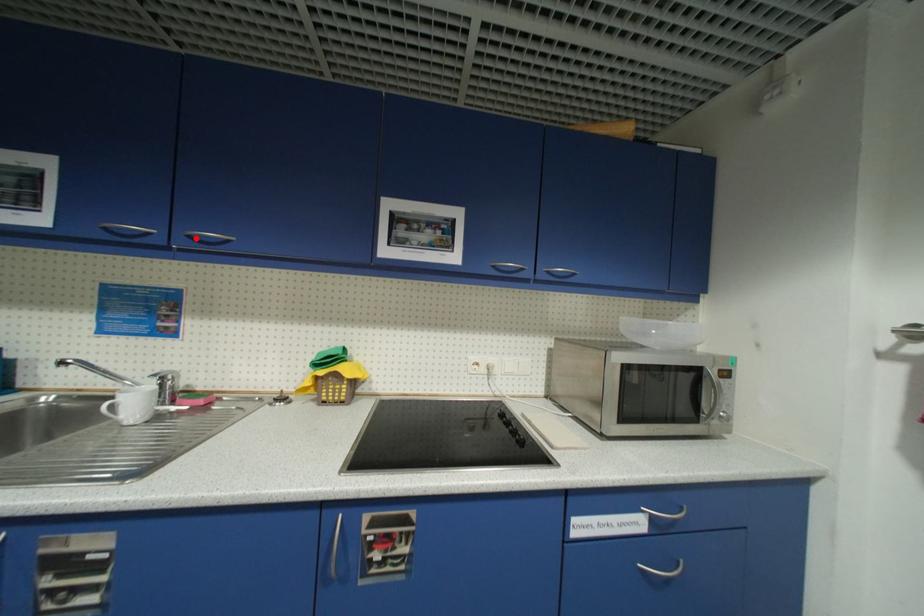
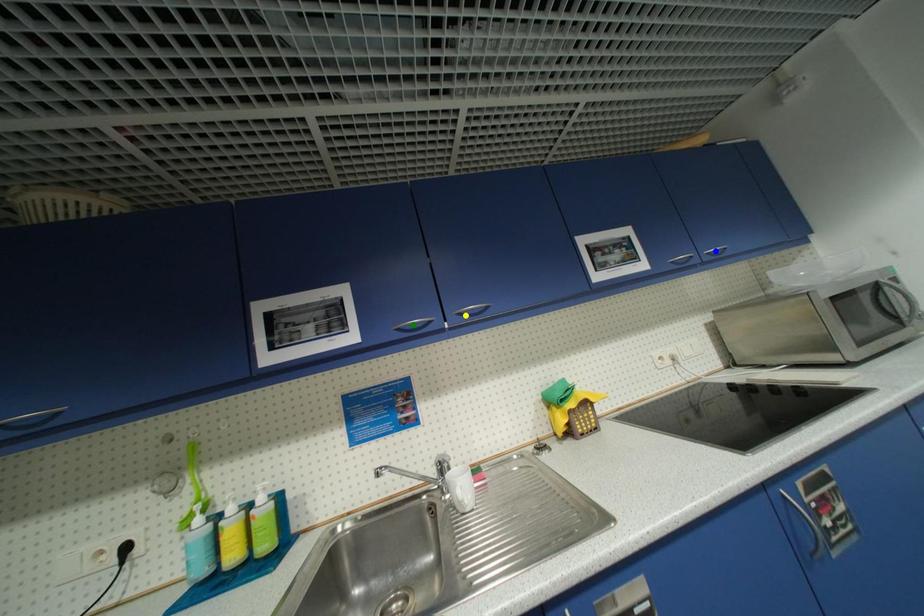
Question: I am providing you with two images of the same scene from different viewpoints. A red point is marked on the first image. You are given multiple points on the second image. Which mark in image 2 goes with the point in image 1?

Choices:
 (A) green point
 (B) yellow point
 (C) blue point

Answer: (B)